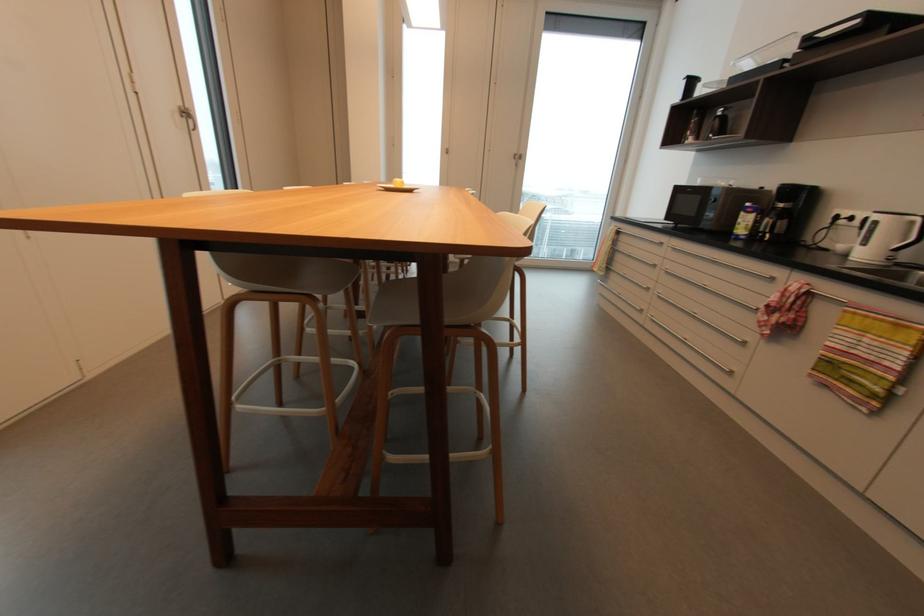
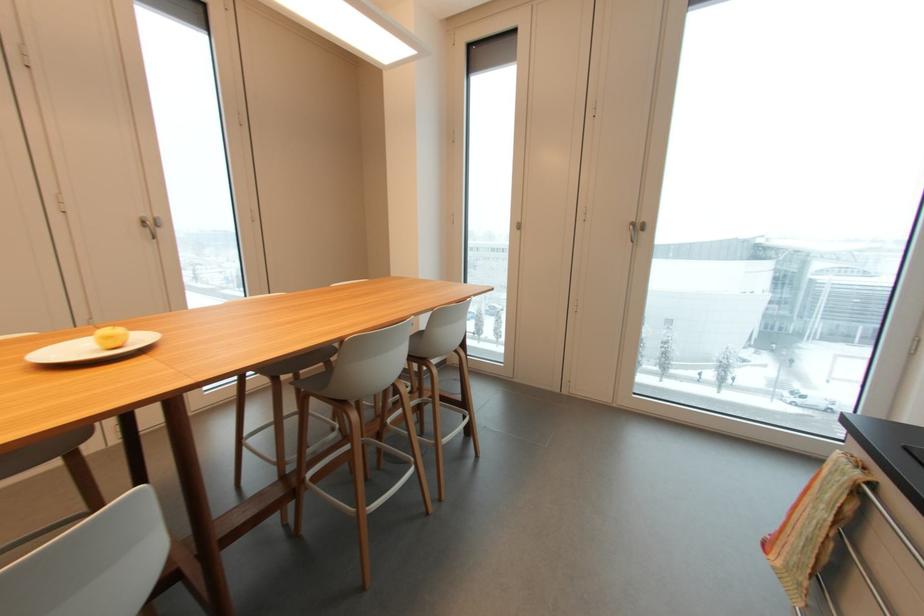
Locate, in the second image, the point that corresponds to point 523,161 in the first image.

(643, 233)